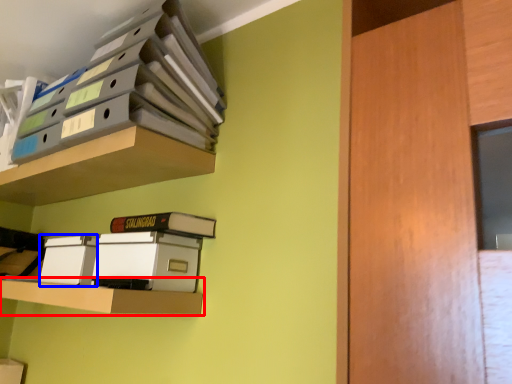
Question: Which of the following is the farthest to the observer, shelf (highlighted by a red box) or storage box (highlighted by a blue box)?

Choices:
 (A) shelf
 (B) storage box

Answer: (B)